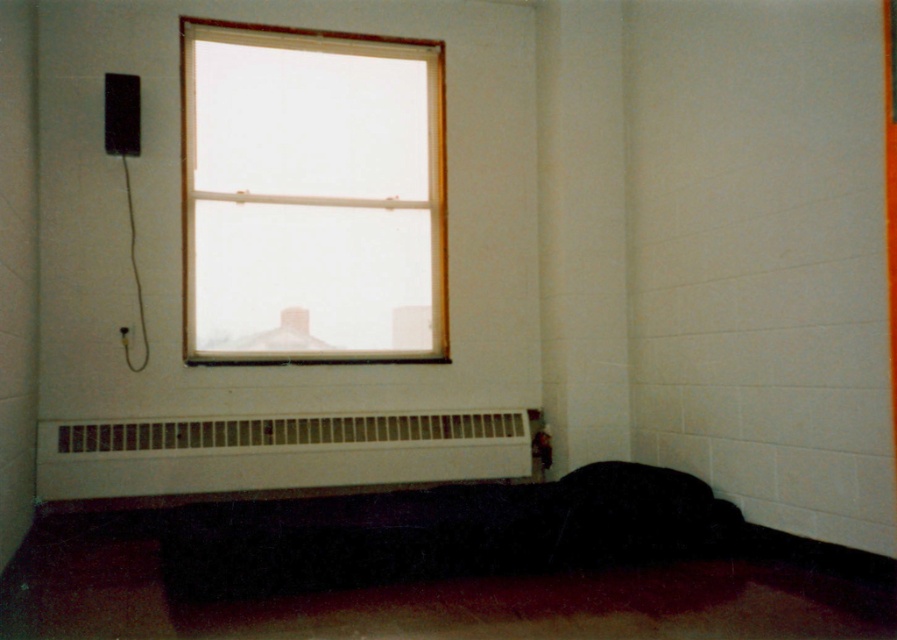
You are a delivery robot that is 1.1 meters tall. You need to move through the room and deliver a package to the white matte radiator at lower center. Can you pass under the clear glass window at upper center without hitting your head?

The distance between the clear glass window at upper center and white matte radiator at lower center is 1.07 meters. Since the robot is 1.1 meters tall, it is slightly taller than the available space, so it cannot pass under the window without hitting its head.

You are standing in the room and want to move from the point at coordinates point (x=213, y=72) to the point at coordinates point (x=382, y=470). Which direction should you move to get closer to the second point?

To move from point (x=213, y=72) to point (x=382, y=470), you should move towards the lower right direction since point (x=382, y=470) is located to the lower right of point (x=213, y=72).